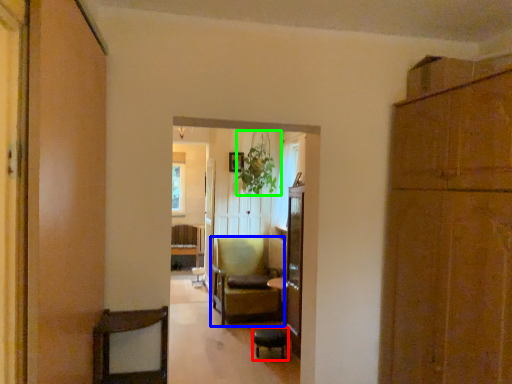
Question: Which is nearer to the bar stool (highlighted by a red box)? chair (highlighted by a blue box) or plant (highlighted by a green box).

Choices:
 (A) chair
 (B) plant

Answer: (A)